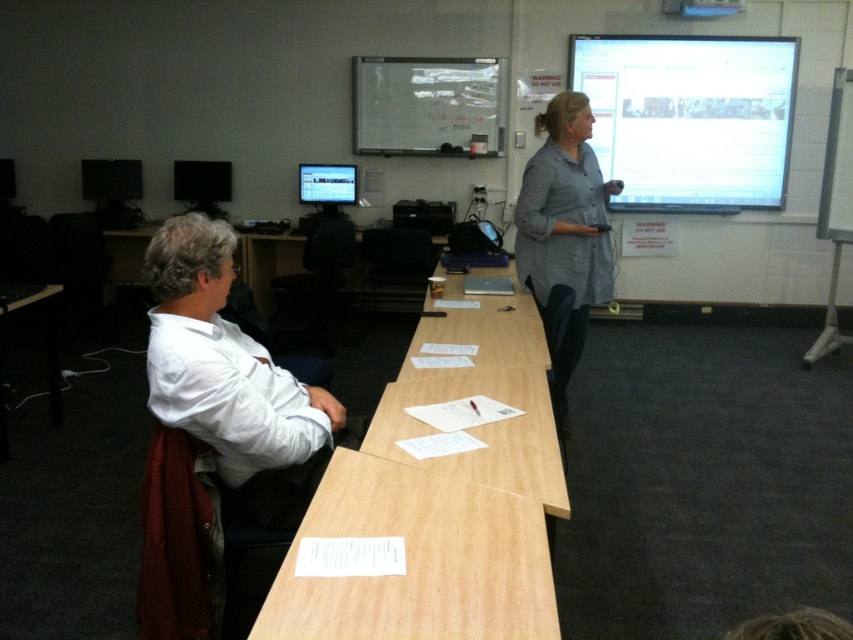
Question: Which point is farther to the camera?

Choices:
 (A) (113, 177)
 (B) (741, 4)
 (C) (532, 172)

Answer: (A)

Question: Where is light brown wood table at center located in relation to blue plastic projector at upper center in the image?

Choices:
 (A) below
 (B) above

Answer: (A)

Question: Can you confirm if light brown wood table at lower center is positioned above gray cotton shirt at center?

Choices:
 (A) yes
 (B) no

Answer: (B)

Question: Is white glossy projection screen at upper center further to the viewer compared to black glossy monitor at upper left?

Choices:
 (A) yes
 (B) no

Answer: (B)

Question: Estimate the real-world distances between objects in this image. Which object is closer to the whiteboard at upper center?

Choices:
 (A) black glossy monitor at upper left
 (B) light brown wood table at center
 (C) matte black monitor at left
 (D) white glossy projection screen at upper center

Answer: (D)

Question: Which object is positioned closest to the light brown wood table at center?

Choices:
 (A) white matte shirt at left
 (B) light brown wood table at lower center
 (C) matte black monitor at left

Answer: (B)